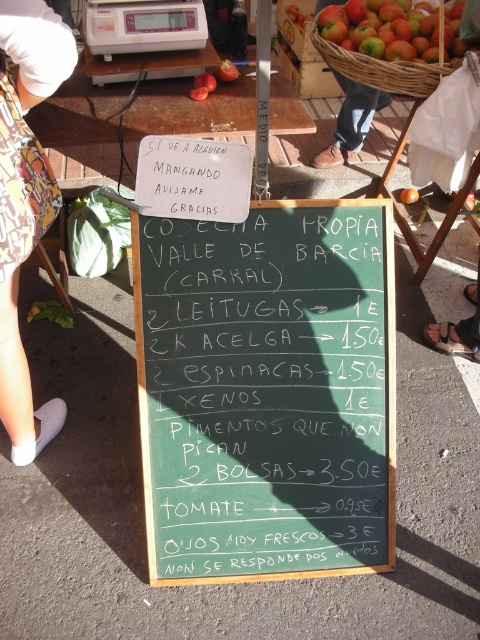
Question: Which point is farther from the camera taking this photo?

Choices:
 (A) (7, 115)
 (B) (208, 433)
 (C) (330, 20)

Answer: (C)

Question: Is green chalkboard at center closer to the viewer compared to ripe red apples at upper right?

Choices:
 (A) no
 (B) yes

Answer: (B)

Question: Based on their relative distances, which object is farther from the white fabric at lower left?

Choices:
 (A) green chalkboard at center
 (B) orange matte tomato at center

Answer: (B)

Question: Is white fabric at lower left further to camera compared to ripe red apples at upper right?

Choices:
 (A) yes
 (B) no

Answer: (B)

Question: Is white fabric at lower left below ripe red apples at upper right?

Choices:
 (A) yes
 (B) no

Answer: (A)

Question: Which object appears closest to the camera in this image?

Choices:
 (A) ripe red apples at upper right
 (B) orange matte tomato at center
 (C) green chalkboard at center

Answer: (C)